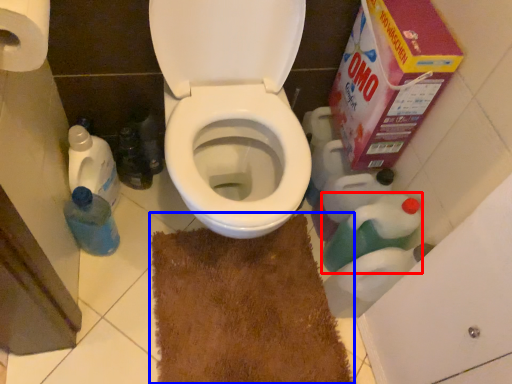
Question: Among these objects, which one is farthest to the camera, cleaning product (highlighted by a red box) or doormat (highlighted by a blue box)?

Choices:
 (A) cleaning product
 (B) doormat

Answer: (A)